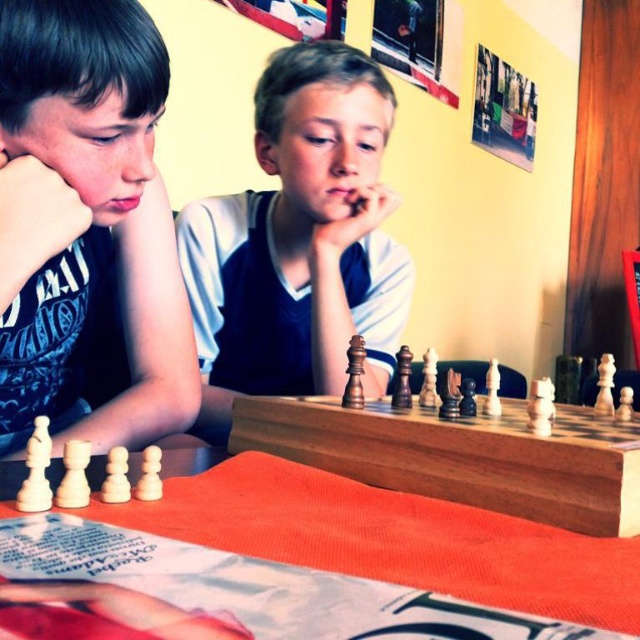
You are a tailor measuring the width of the matte black shirt at left and the wooden chessboard at center. Which object has a smaller width?

The matte black shirt at left has a smaller width than the wooden chessboard at center.

In the scene shown: You are a photographer positioned in front of the chessboard. You want to focus your camera on the point closer to you between point [83,422] and point [292,368]. Which point should you choose?

Point [83,422] is closer to the camera than point [292,368], so you should focus on point [83,422].

Where is the matte black shirt at left located in the image?

The matte black shirt at left is located at point (88,232).